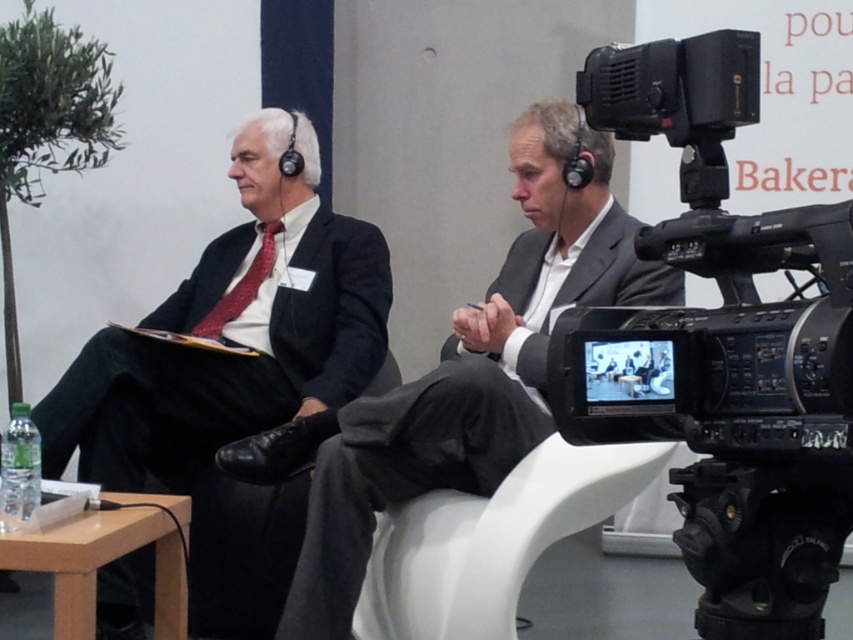
Does point (434, 388) lie behind point (263, 349)?

No, it is not.

Does dark gray suit at center come behind matte red tie at left?

No, it is not.

Does point (321, 516) lie behind point (216, 307)?

No.

Image resolution: width=853 pixels, height=640 pixels. I want to click on dark gray suit at center, so click(x=459, y=404).

Is point (728, 577) less distant than point (312, 492)?

Yes, point (728, 577) is in front of point (312, 492).

Between black plastic video camera at right and dark gray suit at center, which one appears on the right side from the viewer's perspective?

black plastic video camera at right

Does point (752, 225) come farther from viewer compared to point (395, 456)?

No, (752, 225) is closer to viewer.

The height and width of the screenshot is (640, 853). In order to click on black plastic video camera at right in this screenshot , I will do `click(724, 349)`.

Which is behind, point (323, 589) or point (345, 380)?

Positioned behind is point (345, 380).

Identify the location of dark gray suit at center. The width and height of the screenshot is (853, 640). (459, 404).